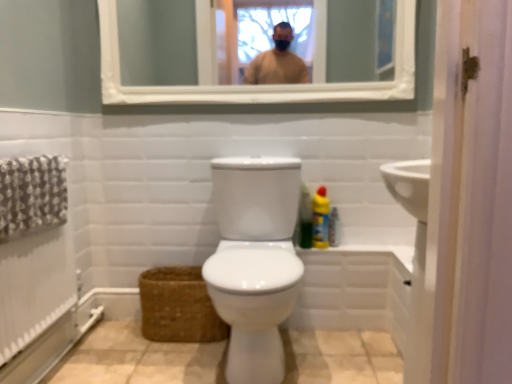
Question: From a real-world perspective, is white wooden mirror at upper center on yellow plastic bottle at right, which appears as the 2th cleaning product when viewed from the left?

Choices:
 (A) yes
 (B) no

Answer: (A)

Question: Can you confirm if white wooden mirror at upper center is smaller than yellow plastic bottle at right, the first cleaning product viewed from the right?

Choices:
 (A) yes
 (B) no

Answer: (B)

Question: Is white wooden mirror at upper center thinner than yellow plastic bottle at right, the first cleaning product viewed from the right?

Choices:
 (A) yes
 (B) no

Answer: (A)

Question: Is white wooden mirror at upper center aimed at yellow plastic bottle at right, the first cleaning product viewed from the right?

Choices:
 (A) no
 (B) yes

Answer: (A)

Question: Is yellow plastic bottle at right, which appears as the 2th cleaning product when viewed from the left, at the back of white wooden mirror at upper center?

Choices:
 (A) yes
 (B) no

Answer: (B)

Question: Is white wooden mirror at upper center at the right side of yellow plastic bottle at right, which appears as the 2th cleaning product when viewed from the left?

Choices:
 (A) no
 (B) yes

Answer: (A)

Question: Does brown woven basket at lower left come behind white glossy bidet at center?

Choices:
 (A) no
 (B) yes

Answer: (B)

Question: Can you confirm if brown woven basket at lower left is wider than white glossy bidet at center?

Choices:
 (A) no
 (B) yes

Answer: (A)

Question: From the image's perspective, is brown woven basket at lower left on top of white glossy bidet at center?

Choices:
 (A) no
 (B) yes

Answer: (A)

Question: Considering the relative positions of brown woven basket at lower left and white glossy bidet at center in the image provided, is brown woven basket at lower left in front of white glossy bidet at center?

Choices:
 (A) yes
 (B) no

Answer: (B)

Question: Is white glossy bidet at center inside brown woven basket at lower left?

Choices:
 (A) no
 (B) yes

Answer: (A)

Question: Is brown woven basket at lower left not close to white glossy bidet at center?

Choices:
 (A) no
 (B) yes

Answer: (A)

Question: Is green matte bottle at right, arranged as the first cleaning product when viewed from the left, shorter than white wooden mirror at upper center?

Choices:
 (A) no
 (B) yes

Answer: (B)